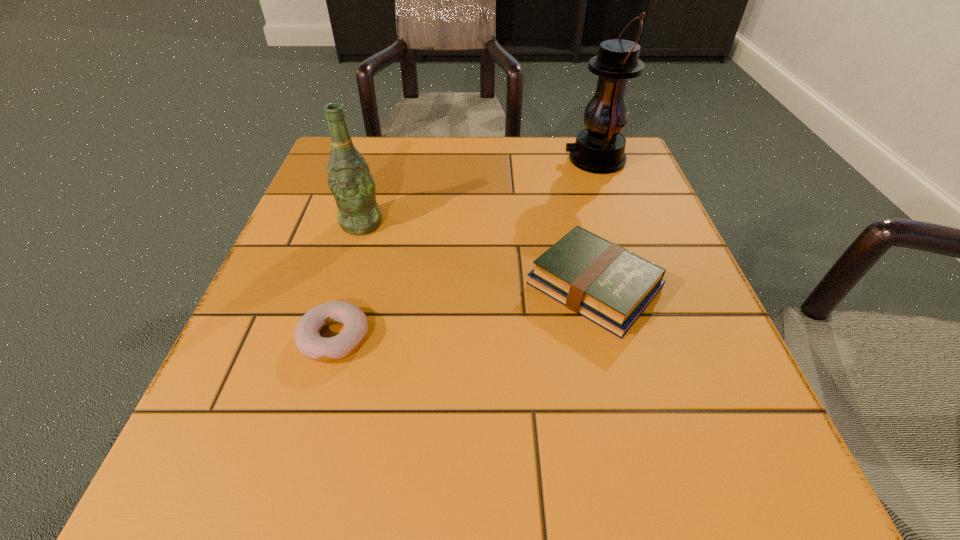
At what (x,y) coordinates should I click in order to perform the action: click on blank space located on the right of the book. Please return your answer as a coordinate pair (x, y). Looking at the image, I should click on [692, 286].

Where is `free space located 0.320m on the right of the shortest object`? free space located 0.320m on the right of the shortest object is located at coordinates 588,338.

At what (x,y) coordinates should I click in order to perform the action: click on object that is at the far edge. Please return your answer as a coordinate pair (x, y). Image resolution: width=960 pixels, height=540 pixels. Looking at the image, I should click on (600, 148).

Where is `beer bottle located in the left edge section of the desktop`? beer bottle located in the left edge section of the desktop is located at coordinates (349, 179).

Locate an element on the screen. doughnut located in the left edge section of the desktop is located at coordinates (308, 341).

I want to click on lantern situated at the right edge, so click(600, 148).

The height and width of the screenshot is (540, 960). Identify the location of book at the right edge. (605, 283).

Find the location of a particular element. object that is at the far right corner is located at coordinates (600, 148).

At what (x,y) coordinates should I click in order to perform the action: click on free region at the far edge. Please return your answer as a coordinate pair (x, y). Image resolution: width=960 pixels, height=540 pixels. Looking at the image, I should click on (539, 156).

The height and width of the screenshot is (540, 960). I want to click on vacant space at the near edge, so click(444, 453).